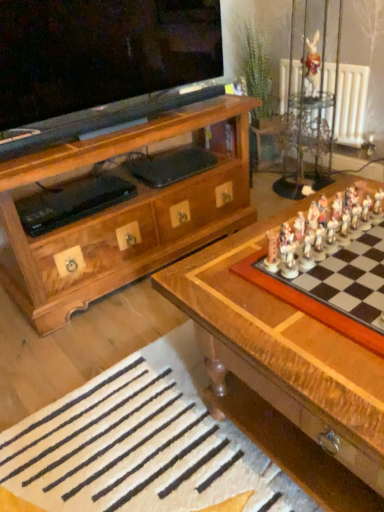
Question: Is wooden chessboard at center at the back of white painted radiator at upper right?

Choices:
 (A) yes
 (B) no

Answer: (B)

Question: Is white painted radiator at upper right not close to wooden chessboard at center?

Choices:
 (A) no
 (B) yes

Answer: (B)

Question: Considering the relative sizes of white painted radiator at upper right and wooden chessboard at center in the image provided, is white painted radiator at upper right thinner than wooden chessboard at center?

Choices:
 (A) yes
 (B) no

Answer: (A)

Question: Could wooden chessboard at center be considered to be inside white painted radiator at upper right?

Choices:
 (A) no
 (B) yes

Answer: (A)

Question: Does white painted radiator at upper right turn towards wooden chessboard at center?

Choices:
 (A) no
 (B) yes

Answer: (A)

Question: Visually, is white wool rug at lower center positioned to the left or to the right of wooden chessboard at center?

Choices:
 (A) left
 (B) right

Answer: (A)

Question: From a real-world perspective, is white wool rug at lower center above or below wooden chessboard at center?

Choices:
 (A) below
 (B) above

Answer: (A)

Question: Considering their positions, is white wool rug at lower center located in front of or behind wooden chessboard at center?

Choices:
 (A) front
 (B) behind

Answer: (B)

Question: From the image's perspective, is white wool rug at lower center above or below wooden chessboard at center?

Choices:
 (A) below
 (B) above

Answer: (A)

Question: Based on their sizes in the image, would you say wooden chessboard at center is bigger or smaller than wooden rabbit at upper right?

Choices:
 (A) big
 (B) small

Answer: (A)

Question: Considering the positions of wooden chessboard at center and wooden rabbit at upper right in the image, is wooden chessboard at center wider or thinner than wooden rabbit at upper right?

Choices:
 (A) thin
 (B) wide

Answer: (B)

Question: Which is correct: wooden chessboard at center is inside wooden rabbit at upper right, or outside of it?

Choices:
 (A) outside
 (B) inside

Answer: (A)

Question: From a real-world perspective, is wooden chessboard at center above or below wooden rabbit at upper right?

Choices:
 (A) below
 (B) above

Answer: (A)

Question: Is point (132, 415) positioned closer to the camera than point (309, 78)?

Choices:
 (A) farther
 (B) closer

Answer: (B)

Question: Considering their positions, is white wool rug at lower center located in front of or behind wooden rabbit at upper right?

Choices:
 (A) behind
 (B) front

Answer: (B)